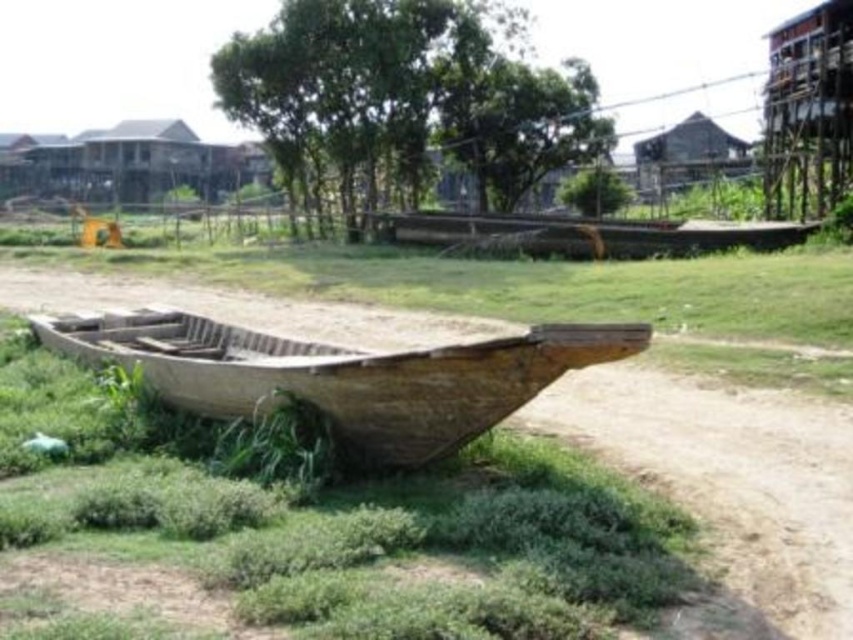
You are standing at the edge of the grassy area near the old boat and want to reach the brown wooden hut at upper right. Which path should you take if you want to avoid the brown dirt track at lower right?

You should avoid the brown dirt track at lower right, which is closer to you, and head towards the brown wooden hut at upper right directly since it is farther away and not on the track.

From the picture: You are standing at the origin point of the image coordinate system. The weathered wood boat at center is located at point 0.584, 0.401. If you want to walk directly to the boat, which direction should you head?

Since you are at the origin point, which is the bottom left corner of the image, the coordinates increase to the right and upwards. The weathered wood boat at center is at point (341,372), so you should head northeast to reach it.